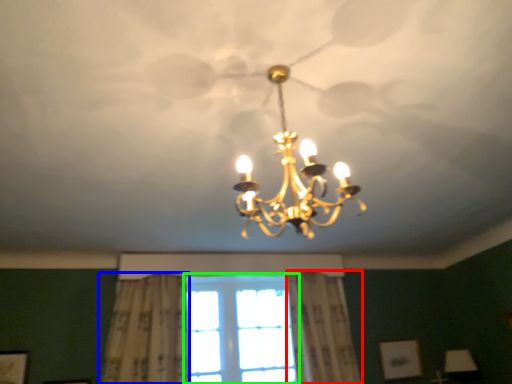
Question: Which object is the farthest from curtain (highlighted by a red box)? Choose among these: curtain (highlighted by a blue box) or window (highlighted by a green box).

Choices:
 (A) curtain
 (B) window

Answer: (A)